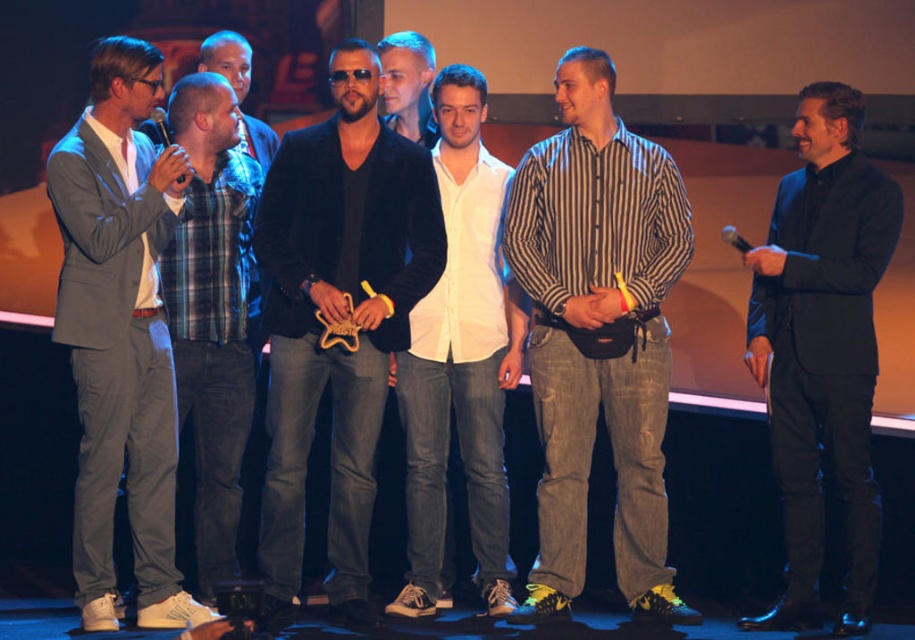
Between striped cotton shirt at center and plaid shirt at left, which one appears on the right side from the viewer's perspective?

Positioned to the right is striped cotton shirt at center.

Does point (686, 608) come closer to viewer compared to point (176, 253)?

Yes, it is.

I want to click on striped cotton shirt at center, so click(598, 333).

Which is more to the left, black shiny suit at right or white shirt at center?

white shirt at center is more to the left.

Is point (865, 532) in front of point (447, 289)?

Yes, it is in front of point (447, 289).

Who is more forward, (809, 212) or (491, 595)?

Point (809, 212) is in front.

Identify the location of black shiny suit at right. Image resolution: width=915 pixels, height=640 pixels. (822, 348).

Between point (552, 468) and point (148, 300), which one is positioned behind?

The point (552, 468) is behind.

Can you confirm if striped cotton shirt at center is smaller than gray suit at left?

Indeed, striped cotton shirt at center has a smaller size compared to gray suit at left.

Between point (587, 502) and point (122, 36), which one is positioned behind?

Point (587, 502)

This screenshot has width=915, height=640. In order to click on striped cotton shirt at center in this screenshot , I will do `click(598, 333)`.